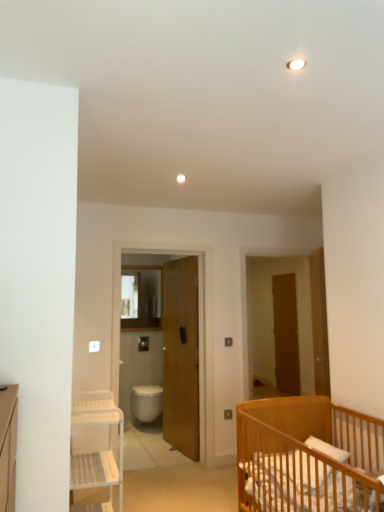
Question: Considering the positions of light brown wooden crib at lower right and wooden screen door at center in the image, is light brown wooden crib at lower right taller or shorter than wooden screen door at center?

Choices:
 (A) tall
 (B) short

Answer: (B)

Question: Is light brown wooden crib at lower right inside the boundaries of wooden screen door at center, or outside?

Choices:
 (A) inside
 (B) outside

Answer: (B)

Question: Considering the real-world distances, which object is closest to the light brown wooden crib at lower right?

Choices:
 (A) wooden door at right, the second door viewed from the right
 (B) wooden screen door at center
 (C) wooden door at center, acting as the first door starting from the left
 (D) white glossy toilet bowl at center
 (E) brown wooden door at center-right, the first door when ordered from back to front

Answer: (A)

Question: Based on their relative distances, which object is farther from the white plastic shelf at left?

Choices:
 (A) wooden screen door at center
 (B) wooden door at right, acting as the third door starting from the back
 (C) white glossy toilet bowl at center
 (D) light brown wooden crib at lower right
 (E) wooden door at center, which is the 2th door from back to front

Answer: (C)